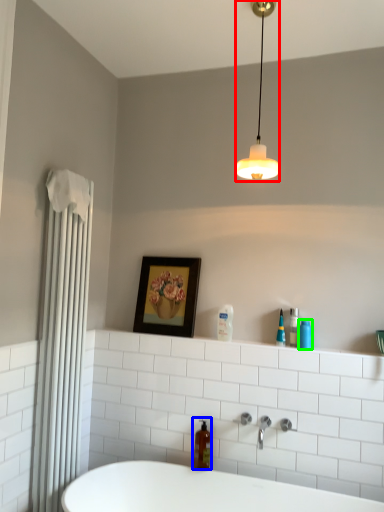
Question: Which object is positioned closest to lamp (highlighted by a red box)? Select from soap dispenser (highlighted by a blue box) and toiletry (highlighted by a green box).

Choices:
 (A) soap dispenser
 (B) toiletry

Answer: (B)